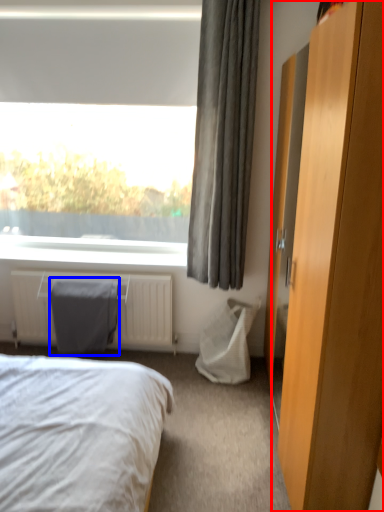
Question: Which of the following is the closest to the observer, dresser (highlighted by a red box) or gray (highlighted by a blue box)?

Choices:
 (A) dresser
 (B) gray

Answer: (A)